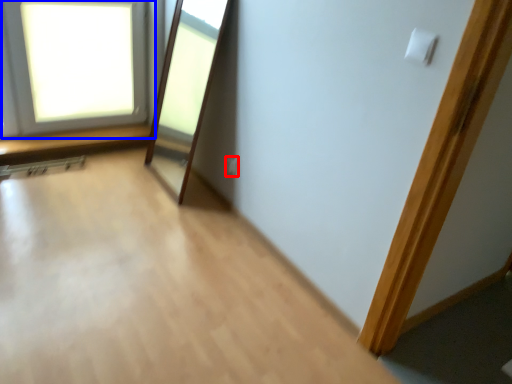
Question: Which point is closer to the camera, electric outlet (highlighted by a red box) or window (highlighted by a blue box)?

Choices:
 (A) electric outlet
 (B) window

Answer: (B)